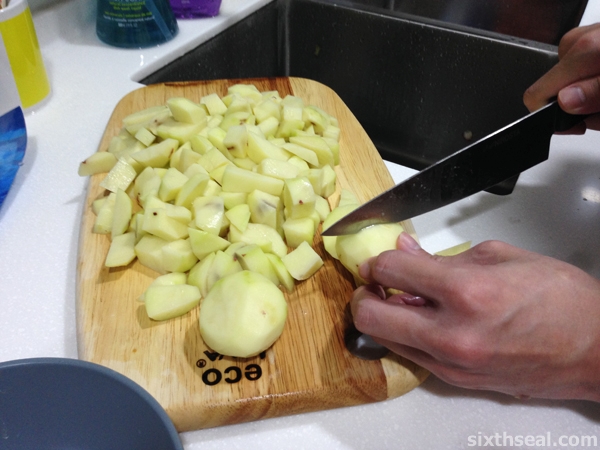
Where is `dish soap`? The height and width of the screenshot is (450, 600). dish soap is located at coordinates (135, 40).